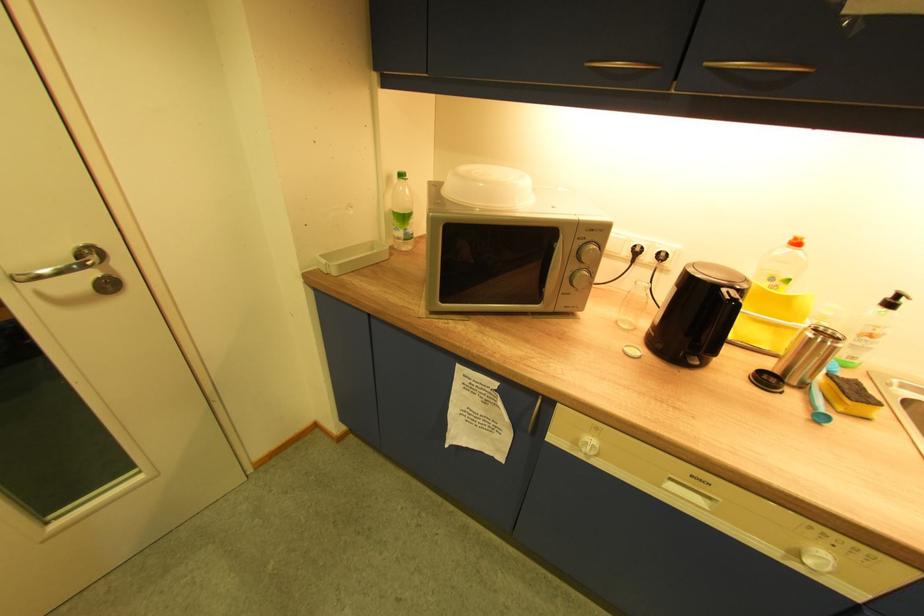
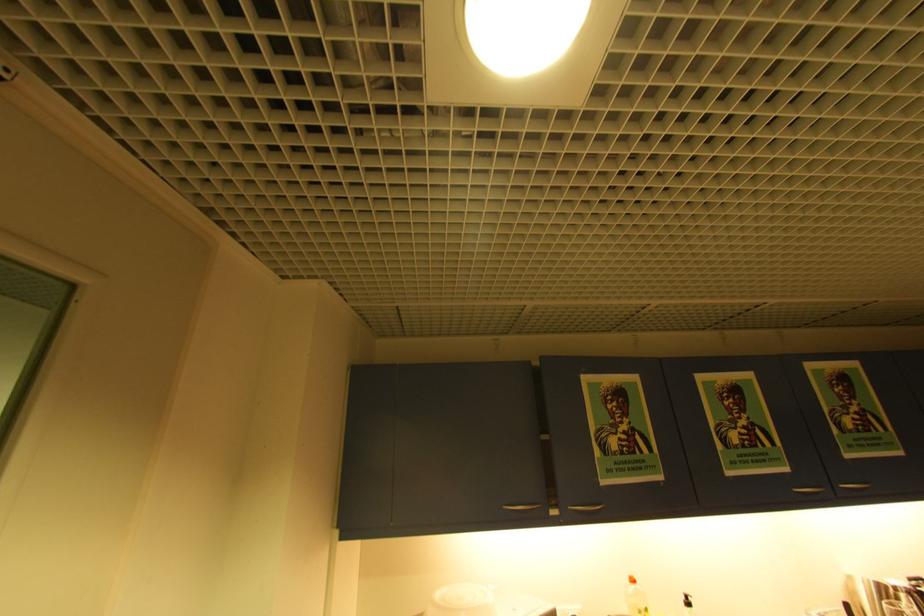
Find the pixel in the second image that matches the point at 895,305 in the first image.

(695, 605)